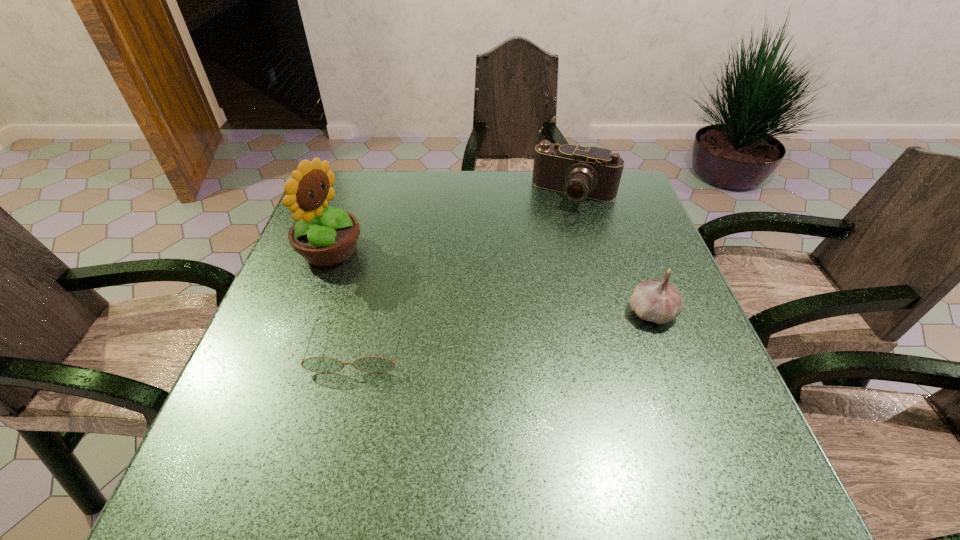
This screenshot has height=540, width=960. I want to click on the shortest object, so click(315, 364).

The image size is (960, 540). Identify the location of garlic. (658, 301).

The height and width of the screenshot is (540, 960). What are the coordinates of `camera` in the screenshot? It's located at (579, 172).

At what (x,y) coordinates should I click in order to perform the action: click on the tallest object. Please return your answer as a coordinate pair (x, y). Looking at the image, I should click on (324, 236).

Find the location of a particular element. The height and width of the screenshot is (540, 960). sunflower is located at coordinates (324, 236).

Find the location of a particular element. vacant space located 0.050m on the face of the sunglasses is located at coordinates (346, 396).

You are a GUI agent. You are given a task and a screenshot of the screen. Output one action in this format:
    pyautogui.click(x=<x>, y=<y>)
    Task: Click on the vacant region located on the front of the garlic
    The width and height of the screenshot is (960, 540).
    Given the screenshot: What is the action you would take?
    675,375

At what (x,y) coordinates should I click in order to perform the action: click on free space located on the front-facing side of the camera. Please return your answer as a coordinate pair (x, y). This screenshot has width=960, height=540. Looking at the image, I should click on click(539, 265).

I want to click on vacant space located 0.340m on the front-facing side of the camera, so click(526, 292).

Find the location of a particular element. free space located 0.050m on the front-facing side of the camera is located at coordinates (559, 221).